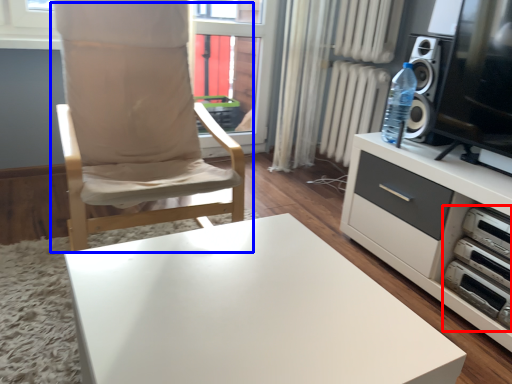
Question: Which point is closer to the camera, stereo (highlighted by a red box) or chair (highlighted by a blue box)?

Choices:
 (A) stereo
 (B) chair

Answer: (B)